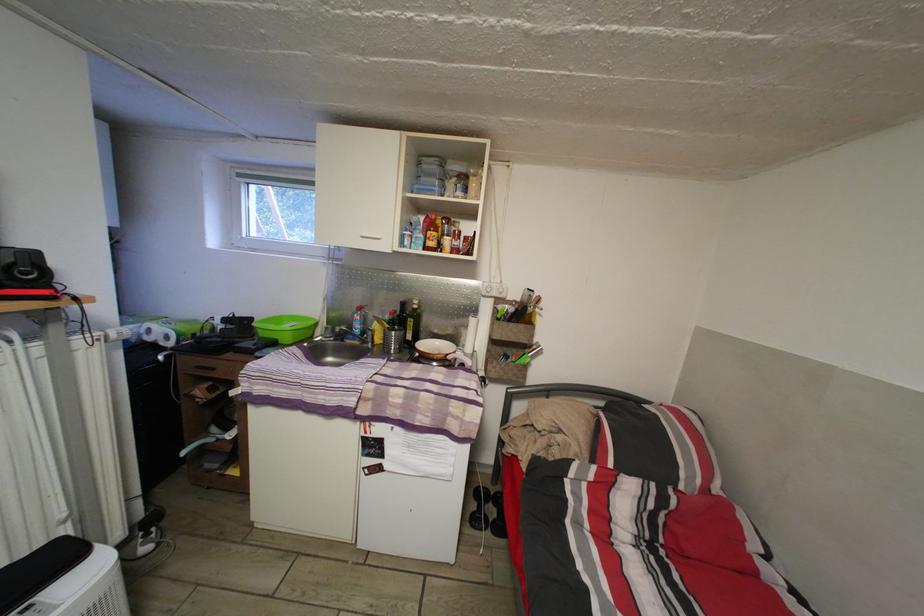
Find where to lift the plastic food container. Please return your answer as a coordinate pair (x, y).

(286, 328)